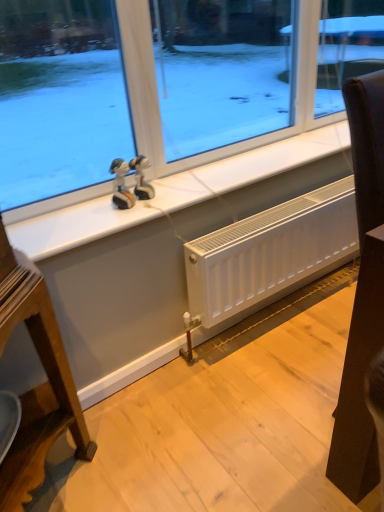
Find the location of a particular element. The image size is (384, 512). vacant area that is in front of matte plastic figurine at center, which ranks as the 1th figurine in left-to-right order is located at coordinates (107, 224).